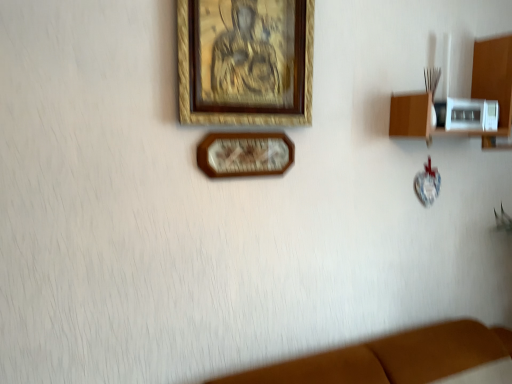
Locate an element on the screen. Image resolution: width=512 pixels, height=384 pixels. wooden shelf at right is located at coordinates (471, 96).

The height and width of the screenshot is (384, 512). What do you see at coordinates (471, 96) in the screenshot?
I see `wooden shelf at right` at bounding box center [471, 96].

In order to click on wooden picture frame at upper center, positioned as the 2th picture frame in bottom-to-top order in this screenshot , I will do `click(245, 62)`.

Between wooden shelf at right and wooden picture frame at upper center, positioned as the 2th picture frame in bottom-to-top order, which one is positioned in front?

wooden picture frame at upper center, positioned as the 2th picture frame in bottom-to-top order, is closer to the camera.

This screenshot has width=512, height=384. I want to click on shelf located underneath the wooden picture frame at upper center, acting as the first picture frame starting from the top (from a real-world perspective), so click(x=471, y=96).

Is wooden shelf at right oriented towards wooden picture frame at upper center, positioned as the 2th picture frame in bottom-to-top order?

No, wooden shelf at right does not turn towards wooden picture frame at upper center, positioned as the 2th picture frame in bottom-to-top order.

From a real-world perspective, relative to wooden picture frame at upper center, acting as the first picture frame starting from the top, is wooden shelf at right vertically above or below?

In terms of real-world spatial position, wooden shelf at right is below wooden picture frame at upper center, acting as the first picture frame starting from the top.

Is wooden clock at center, positioned as the 2th picture frame in top-to-bottom order, far away from wooden picture frame at upper center, acting as the first picture frame starting from the top?

No, wooden clock at center, positioned as the 2th picture frame in top-to-bottom order, is not far from wooden picture frame at upper center, acting as the first picture frame starting from the top.

Is wooden clock at center, positioned as the 2th picture frame in top-to-bottom order, taller than wooden picture frame at upper center, positioned as the 2th picture frame in bottom-to-top order?

No.

Is wooden clock at center, positioned as the 2th picture frame in top-to-bottom order, thinner than wooden picture frame at upper center, positioned as the 2th picture frame in bottom-to-top order?

Indeed, wooden clock at center, positioned as the 2th picture frame in top-to-bottom order, has a lesser width compared to wooden picture frame at upper center, positioned as the 2th picture frame in bottom-to-top order.

Is wooden clock at center, the 1th picture frame positioned from the bottom, situated inside wooden picture frame at upper center, acting as the first picture frame starting from the top, or outside?

wooden clock at center, the 1th picture frame positioned from the bottom, exists outside the volume of wooden picture frame at upper center, acting as the first picture frame starting from the top.

From the picture: Which of these two, wooden picture frame at upper center, positioned as the 2th picture frame in bottom-to-top order, or wooden clock at center, positioned as the 2th picture frame in top-to-bottom order, is bigger?

Bigger between the two is wooden picture frame at upper center, positioned as the 2th picture frame in bottom-to-top order.

Between wooden picture frame at upper center, positioned as the 2th picture frame in bottom-to-top order, and wooden clock at center, positioned as the 2th picture frame in top-to-bottom order, which one is positioned in front?

wooden picture frame at upper center, positioned as the 2th picture frame in bottom-to-top order, is more forward.

Consider the image. Is wooden picture frame at upper center, acting as the first picture frame starting from the top, taller or shorter than wooden clock at center, the 1th picture frame positioned from the bottom?

Clearly, wooden picture frame at upper center, acting as the first picture frame starting from the top, is taller compared to wooden clock at center, the 1th picture frame positioned from the bottom.

Where is `picture frame that is under the wooden picture frame at upper center, acting as the first picture frame starting from the top (from a real-world perspective)`? The image size is (512, 384). picture frame that is under the wooden picture frame at upper center, acting as the first picture frame starting from the top (from a real-world perspective) is located at coordinates (245, 154).

You are a GUI agent. You are given a task and a screenshot of the screen. Output one action in this format:
    pyautogui.click(x=<x>, y=<y>)
    Task: Click on the shelf that appears above the wooden clock at center, positioned as the 2th picture frame in top-to-bottom order (from a real-world perspective)
    
    Given the screenshot: What is the action you would take?
    pyautogui.click(x=471, y=96)

Considering the sizes of objects wooden clock at center, positioned as the 2th picture frame in top-to-bottom order, and wooden shelf at right in the image provided, who is bigger, wooden clock at center, positioned as the 2th picture frame in top-to-bottom order, or wooden shelf at right?

With larger size is wooden shelf at right.

Would you say wooden clock at center, positioned as the 2th picture frame in top-to-bottom order, is outside wooden shelf at right?

Yes, wooden clock at center, positioned as the 2th picture frame in top-to-bottom order, is located beyond the bounds of wooden shelf at right.

Consider the image. Is wooden clock at center, the 1th picture frame positioned from the bottom, aimed at wooden shelf at right?

No, wooden clock at center, the 1th picture frame positioned from the bottom, is not facing towards wooden shelf at right.

Does wooden shelf at right contain wooden clock at center, the 1th picture frame positioned from the bottom?

No, wooden clock at center, the 1th picture frame positioned from the bottom, is not inside wooden shelf at right.

Is wooden shelf at right shorter than wooden clock at center, positioned as the 2th picture frame in top-to-bottom order?

No.

Can you confirm if wooden shelf at right is wider than wooden clock at center, the 1th picture frame positioned from the bottom?

Yes.

In the image, is wooden shelf at right on the left side or the right side of wooden clock at center, the 1th picture frame positioned from the bottom?

wooden shelf at right is to the right of wooden clock at center, the 1th picture frame positioned from the bottom.

How many degrees apart are the facing directions of wooden picture frame at upper center, acting as the first picture frame starting from the top, and wooden shelf at right?

wooden picture frame at upper center, acting as the first picture frame starting from the top, and wooden shelf at right are facing 1.55 degrees away from each other.

Is wooden picture frame at upper center, positioned as the 2th picture frame in bottom-to-top order, bigger than wooden shelf at right?

Actually, wooden picture frame at upper center, positioned as the 2th picture frame in bottom-to-top order, might be smaller than wooden shelf at right.

Are wooden picture frame at upper center, acting as the first picture frame starting from the top, and wooden shelf at right beside each other?

There is a gap between wooden picture frame at upper center, acting as the first picture frame starting from the top, and wooden shelf at right.

From a real-world perspective, relative to wooden shelf at right, is wooden picture frame at upper center, positioned as the 2th picture frame in bottom-to-top order, vertically above or below?

Clearly, from a real-world perspective, wooden picture frame at upper center, positioned as the 2th picture frame in bottom-to-top order, is above wooden shelf at right.

Where is `picture frame above the wooden shelf at right (from the image's perspective)`? Image resolution: width=512 pixels, height=384 pixels. picture frame above the wooden shelf at right (from the image's perspective) is located at coordinates (245, 62).

In order to click on picture frame located above the wooden clock at center, positioned as the 2th picture frame in top-to-bottom order (from a real-world perspective) in this screenshot , I will do `click(245, 62)`.

Looking at the image, which one is located closer to wooden shelf at right, wooden clock at center, positioned as the 2th picture frame in top-to-bottom order, or wooden picture frame at upper center, acting as the first picture frame starting from the top?

wooden picture frame at upper center, acting as the first picture frame starting from the top.

Estimate the real-world distances between objects in this image. Which object is closer to wooden shelf at right, wooden picture frame at upper center, positioned as the 2th picture frame in bottom-to-top order, or wooden clock at center, positioned as the 2th picture frame in top-to-bottom order?

wooden picture frame at upper center, positioned as the 2th picture frame in bottom-to-top order, is positioned closer to the anchor wooden shelf at right.

Which object lies nearer to the anchor point wooden picture frame at upper center, positioned as the 2th picture frame in bottom-to-top order, wooden clock at center, the 1th picture frame positioned from the bottom, or wooden shelf at right?

wooden clock at center, the 1th picture frame positioned from the bottom, is closer to wooden picture frame at upper center, positioned as the 2th picture frame in bottom-to-top order.

Based on their spatial positions, is wooden shelf at right or wooden picture frame at upper center, acting as the first picture frame starting from the top, closer to wooden clock at center, the 1th picture frame positioned from the bottom?

wooden picture frame at upper center, acting as the first picture frame starting from the top, lies closer to wooden clock at center, the 1th picture frame positioned from the bottom, than the other object.

In the scene shown: Which object lies nearer to the anchor point wooden picture frame at upper center, acting as the first picture frame starting from the top, wooden shelf at right or wooden clock at center, the 1th picture frame positioned from the bottom?

wooden clock at center, the 1th picture frame positioned from the bottom, is positioned closer to the anchor wooden picture frame at upper center, acting as the first picture frame starting from the top.

Which object lies further to the anchor point wooden clock at center, positioned as the 2th picture frame in top-to-bottom order, wooden picture frame at upper center, acting as the first picture frame starting from the top, or wooden shelf at right?

Among the two, wooden shelf at right is located further to wooden clock at center, positioned as the 2th picture frame in top-to-bottom order.

Locate an element on the screen. The width and height of the screenshot is (512, 384). picture frame situated between wooden picture frame at upper center, acting as the first picture frame starting from the top, and wooden shelf at right from left to right is located at coordinates (245, 154).